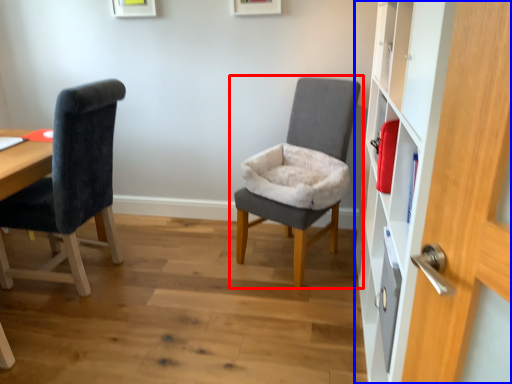
Question: Which point is further to the camera, chair (highlighted by a red box) or dresser (highlighted by a blue box)?

Choices:
 (A) chair
 (B) dresser

Answer: (A)